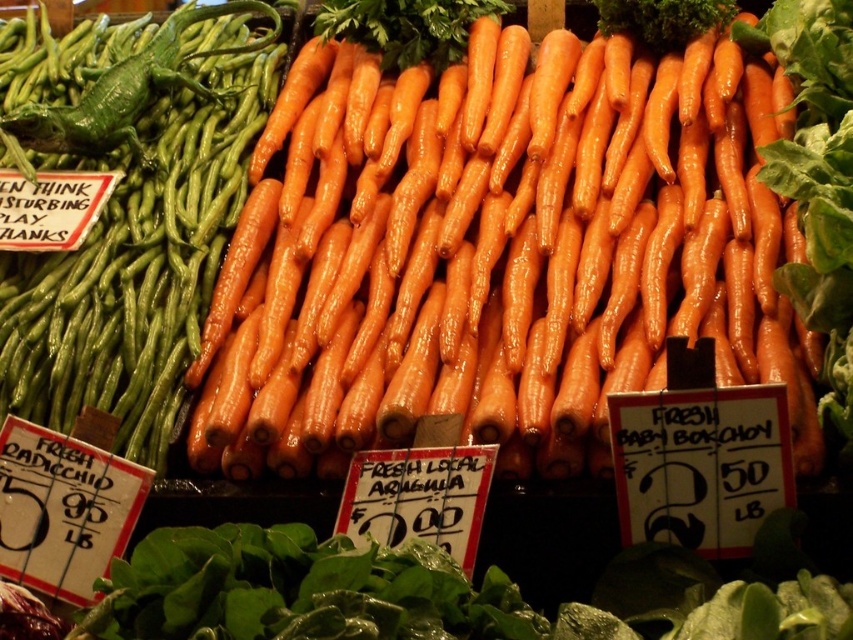
Is point (102, 371) farther from viewer compared to point (193, 8)?

No.

Which is above, green glossy beans at upper left or green matte string beans at upper left?

green matte string beans at upper left is above.

Image resolution: width=853 pixels, height=640 pixels. In order to click on green glossy beans at upper left in this screenshot , I will do `click(132, 216)`.

At what (x,y) coordinates should I click in order to perform the action: click on green glossy beans at upper left. Please return your answer as a coordinate pair (x, y). Looking at the image, I should click on (132, 216).

Who is positioned more to the right, orange smooth carrots at center or green matte string beans at upper left?

orange smooth carrots at center is more to the right.

Does orange smooth carrots at center appear under green matte string beans at upper left?

Yes, orange smooth carrots at center is below green matte string beans at upper left.

Who is more distant from viewer, (648,355) or (254,12)?

The point (254,12) is more distant.

This screenshot has height=640, width=853. I want to click on orange smooth carrots at center, so click(497, 252).

In the scene shown: Between orange smooth carrots at center and green glossy beans at upper left, which one is positioned higher?

green glossy beans at upper left

Is orange smooth carrots at center in front of green glossy beans at upper left?

Yes, it is in front of green glossy beans at upper left.

Who is more forward, (376, 198) or (4, 337)?

Point (4, 337) is in front.

What are the coordinates of `orange smooth carrots at center` in the screenshot? It's located at (497, 252).